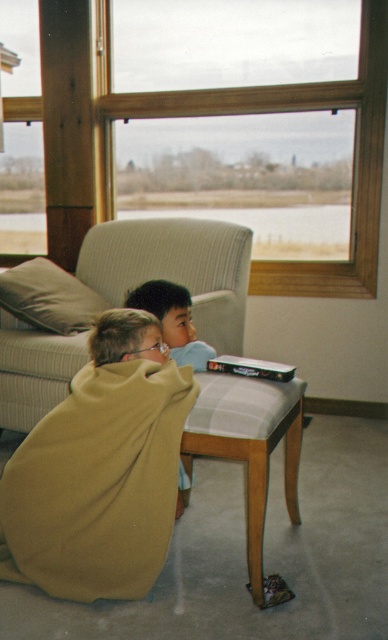
The height and width of the screenshot is (640, 388). Describe the element at coordinates (249, 445) in the screenshot. I see `light gray fabric stool at lower center` at that location.

Who is more forward, (273, 396) or (176, 294)?

Point (273, 396) is in front.

Is point (218, 413) behind point (199, 365)?

No, (218, 413) is in front of (199, 365).

Locate an element on the screen. light gray fabric stool at lower center is located at coordinates (249, 445).

Can you confirm if light gray fabric pillow at left is positioned to the right of matte blue shirt at center?

No, light gray fabric pillow at left is not to the right of matte blue shirt at center.

What do you see at coordinates (48, 298) in the screenshot?
I see `light gray fabric pillow at left` at bounding box center [48, 298].

Does point (46, 323) lie behind point (152, 308)?

Yes, point (46, 323) is behind point (152, 308).

Identify the location of light gray fabric pillow at left. The width and height of the screenshot is (388, 640). (48, 298).

Is soft yellow blanket at lower left above wooden frame at upper center?

Actually, soft yellow blanket at lower left is below wooden frame at upper center.

Does point (98, 596) come behind point (107, 132)?

That is False.

Locate an element on the screen. The height and width of the screenshot is (640, 388). soft yellow blanket at lower left is located at coordinates (98, 483).